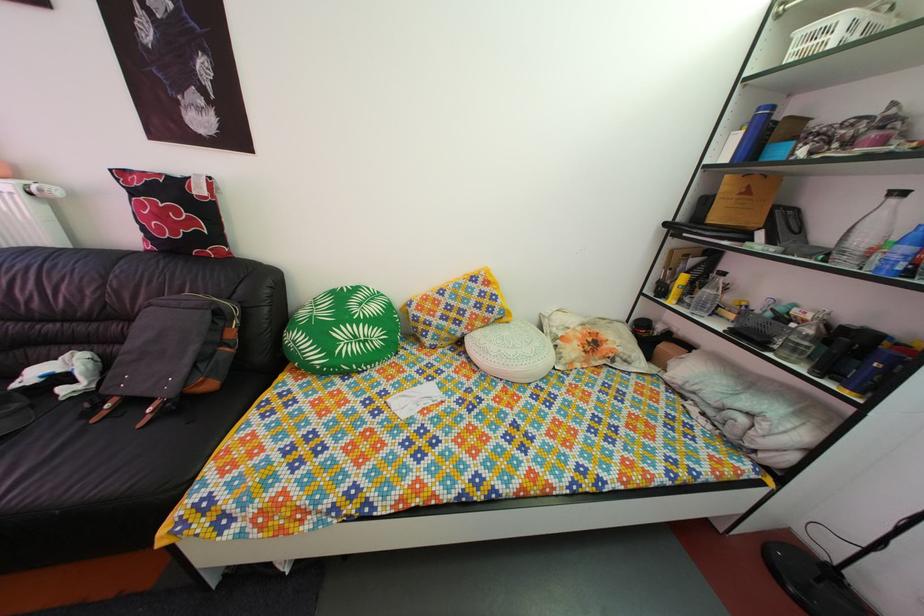
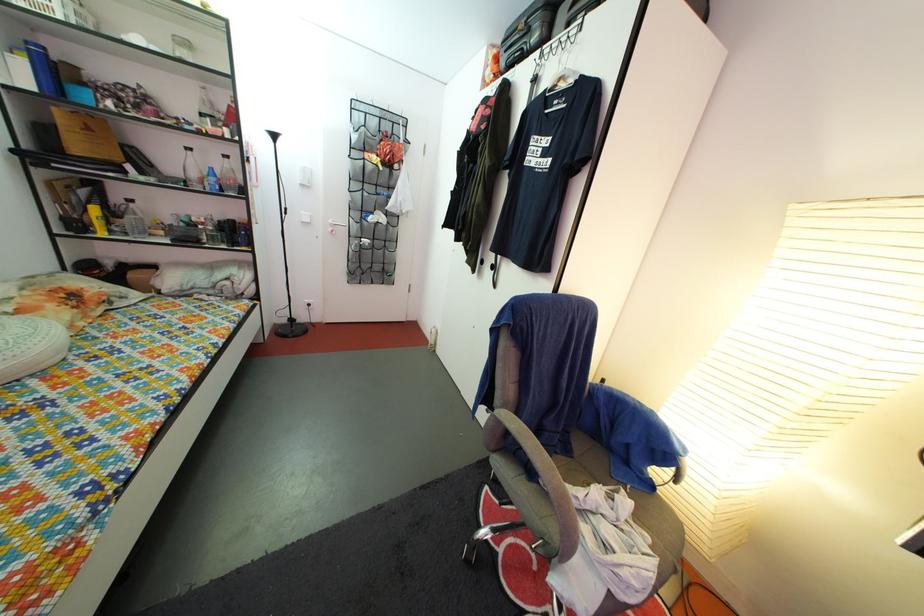
The point at (881, 260) is marked in the first image. Where is the corresponding point in the second image?

(211, 188)